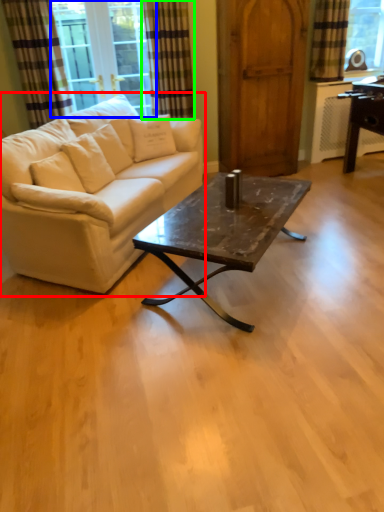
Question: Which object is the farthest from studio couch (highlighted by a red box)? Choose among these: window screen (highlighted by a blue box) or curtain (highlighted by a green box).

Choices:
 (A) window screen
 (B) curtain

Answer: (A)